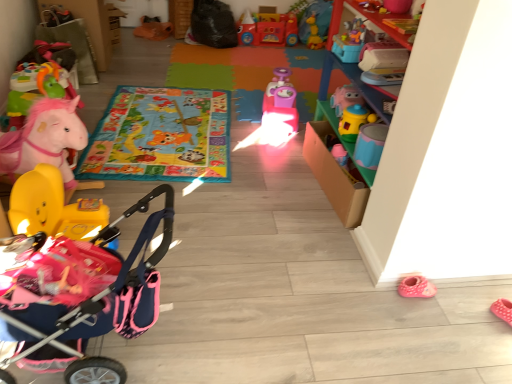
You are a GUI agent. You are given a task and a screenshot of the screen. Output one action in this format:
    pyautogui.click(x=<x>, y=<y>)
    Task: Click on the free spot in front of rubber duck at upper center, arranged as the 9th toy when viewed from the front
    
    Given the screenshot: What is the action you would take?
    pyautogui.click(x=306, y=52)